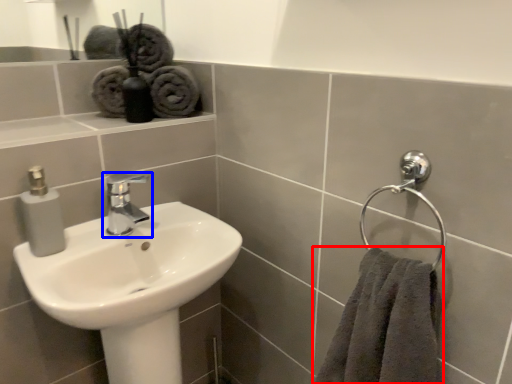
Question: Which point is further to the camera, towel (highlighted by a red box) or tap (highlighted by a blue box)?

Choices:
 (A) towel
 (B) tap

Answer: (B)